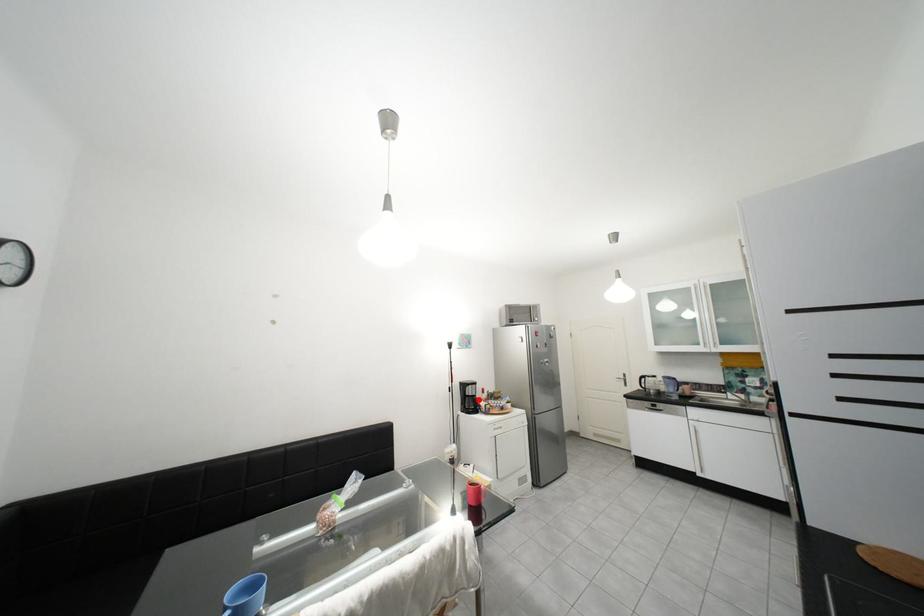
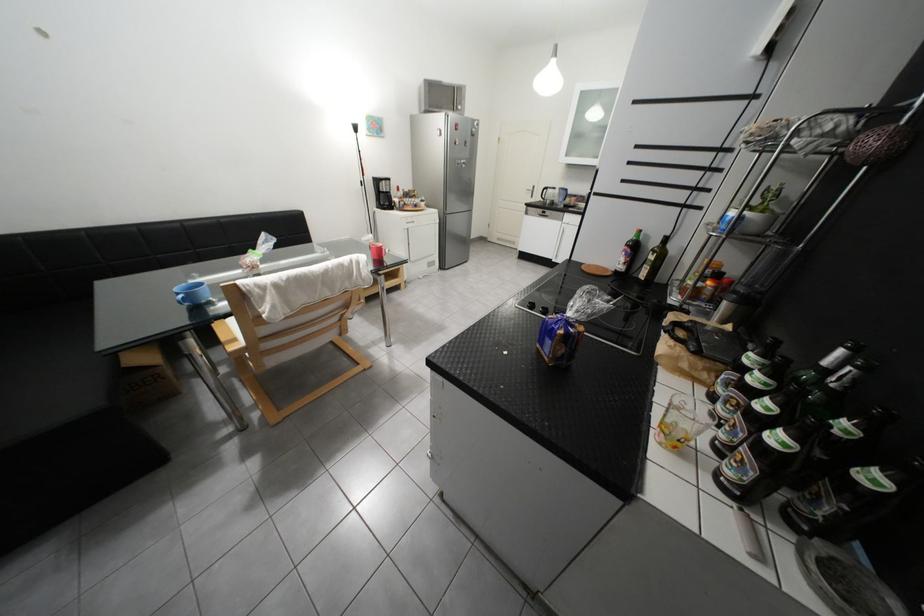
Question: I am providing you with two images of the same scene from different viewpoints. In image1, a red point is highlighted. Considering the same 3D point in image2, which of the following is correct?

Choices:
 (A) It is closer
 (B) It is farther

Answer: (A)